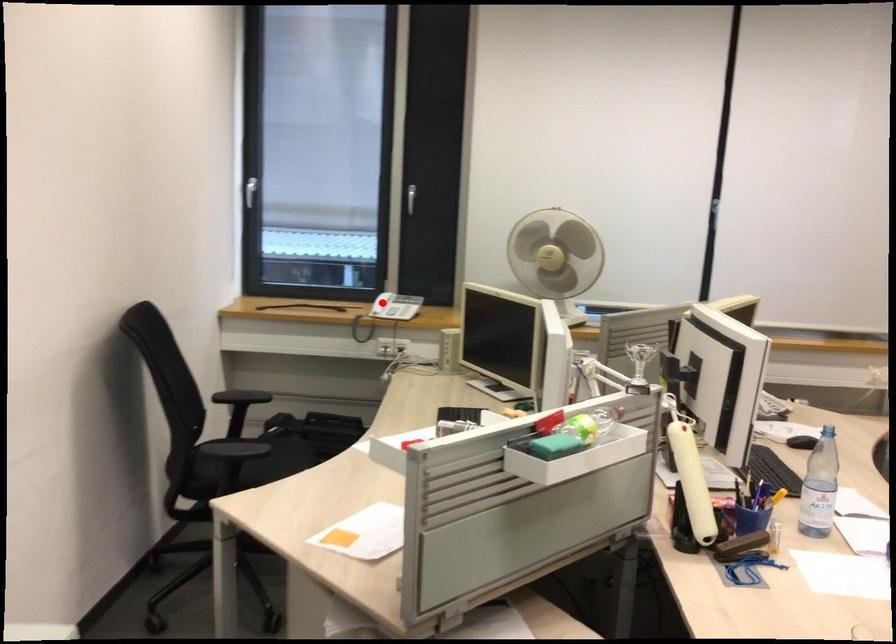
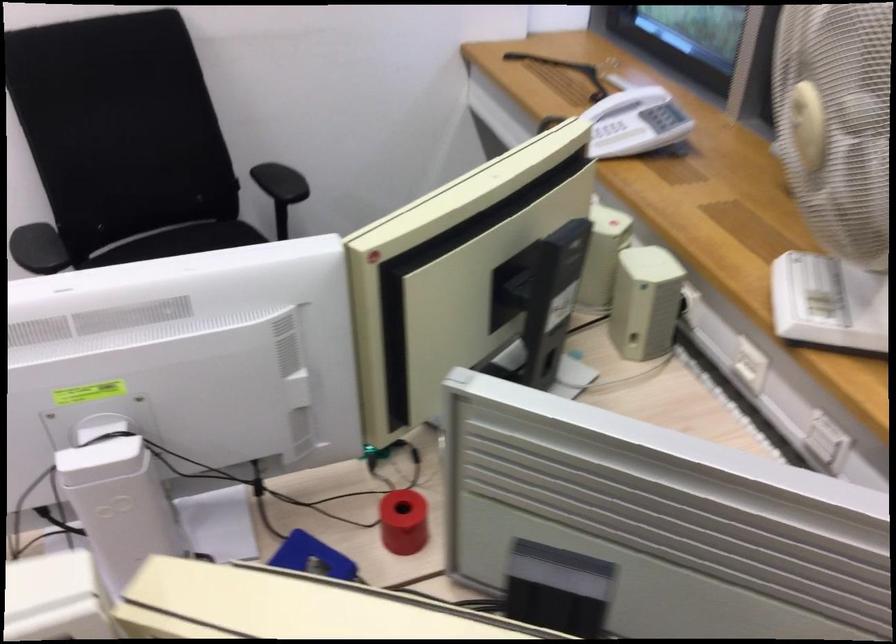
Question: I am providing you with two images of the same scene from different viewpoints. A red point is shown in image1. For the corresponding object point in image2, is it positioned nearer or farther from the camera?

Choices:
 (A) Nearer
 (B) Farther

Answer: (A)